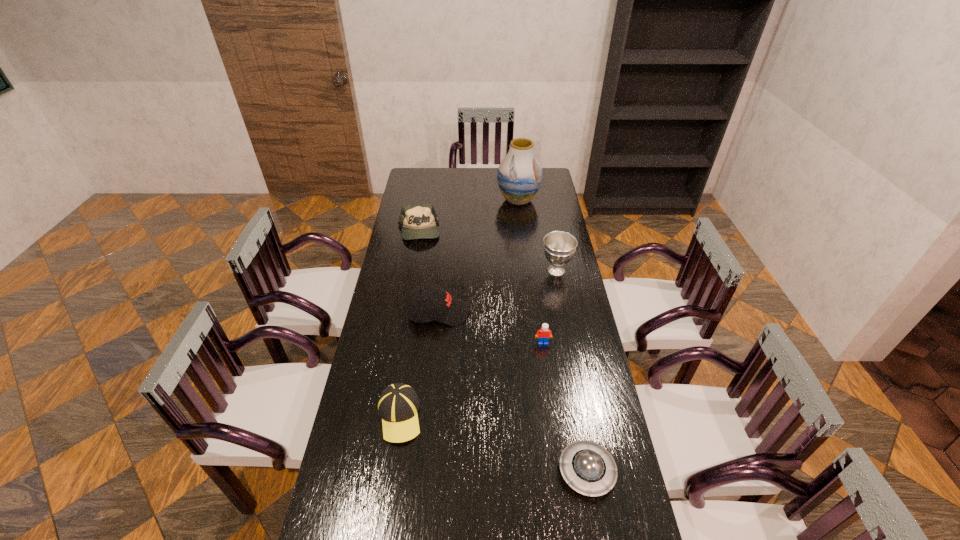
Find the location of a particular element. This screenshot has height=540, width=960. Lego at the right edge is located at coordinates (543, 335).

Identify the location of saucer located in the right edge section of the desktop. The width and height of the screenshot is (960, 540). (588, 467).

Where is `object at the far right corner`? The image size is (960, 540). object at the far right corner is located at coordinates (519, 175).

In the image, there is a desktop. Where is `vacant space at the left edge`? vacant space at the left edge is located at coordinates (388, 294).

The height and width of the screenshot is (540, 960). Find the location of `free spot at the right edge of the desktop`. free spot at the right edge of the desktop is located at coordinates (572, 305).

Identify the location of free space between the nearest baseball cap and the sixth nearest object. Image resolution: width=960 pixels, height=540 pixels. (409, 323).

At what (x,y) coordinates should I click in order to perform the action: click on free point between the third nearest object and the vase. Please return your answer as a coordinate pair (x, y). The height and width of the screenshot is (540, 960). Looking at the image, I should click on (531, 271).

At what (x,y) coordinates should I click in order to perform the action: click on free space between the fourth nearest object and the nearest baseball cap. Please return your answer as a coordinate pair (x, y). Looking at the image, I should click on (419, 364).

At what (x,y) coordinates should I click in order to perform the action: click on vacant area that lies between the third farthest object and the Lego. Please return your answer as a coordinate pair (x, y). Looking at the image, I should click on (550, 307).

Where is `vacant region between the farthest object and the farthest baseball cap`? The height and width of the screenshot is (540, 960). vacant region between the farthest object and the farthest baseball cap is located at coordinates (468, 215).